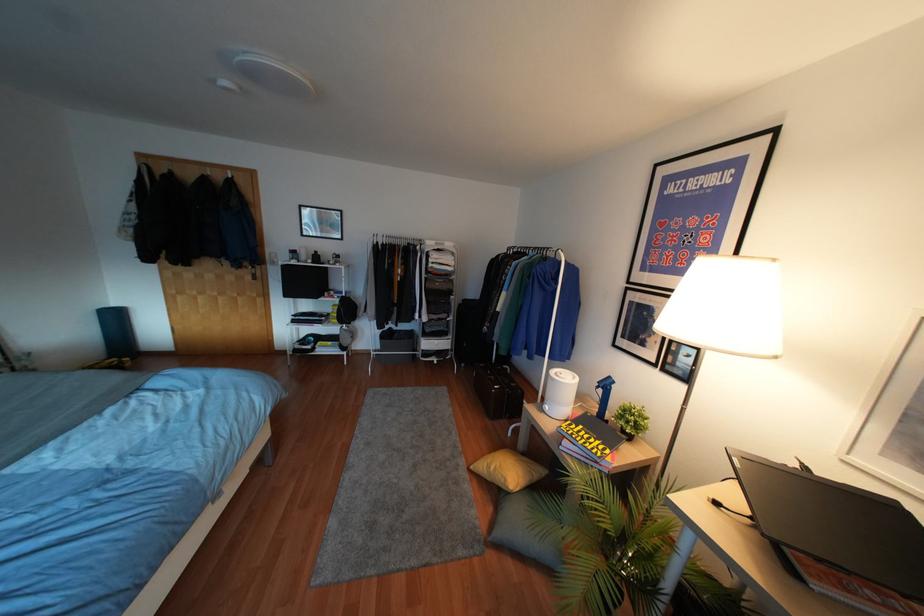
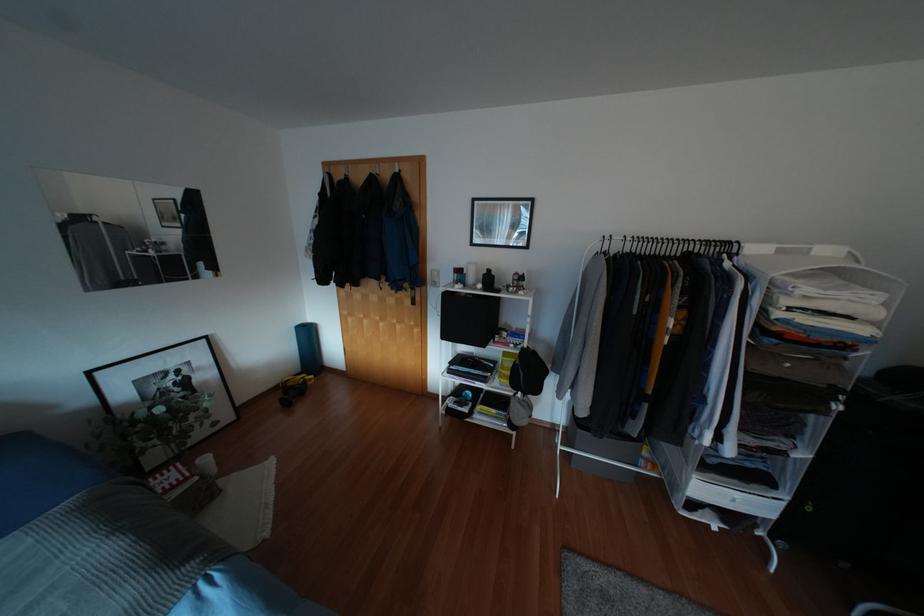
Locate, in the second image, the point that corresponds to (x=346, y=310) in the first image.

(528, 371)